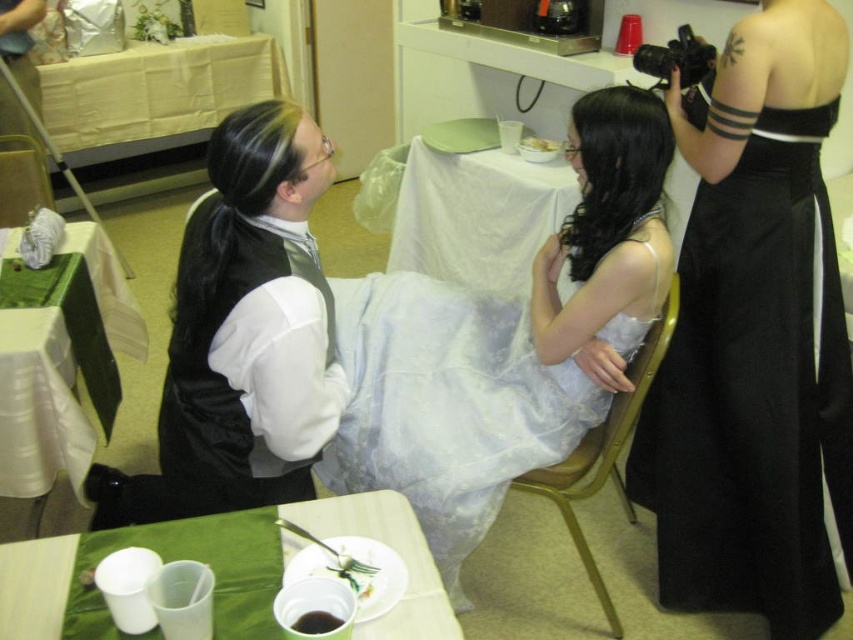
Does black satin dress at right lie in front of green fabric table at lower left?

Yes, it is in front of green fabric table at lower left.

Who is positioned more to the right, black satin dress at right or green fabric table at lower left?

From the viewer's perspective, black satin dress at right appears more on the right side.

Locate an element on the screen. The height and width of the screenshot is (640, 853). black satin dress at right is located at coordinates click(x=753, y=394).

Where is `black satin dress at right`? This screenshot has height=640, width=853. black satin dress at right is located at coordinates (753, 394).

Between point (109, 392) and point (564, 272), which one is positioned in front?

Point (109, 392)

Who is positioned more to the right, green fabric table at lower left or white cloth table at center?

From the viewer's perspective, white cloth table at center appears more on the right side.

Find the location of `green fabric table at lower left`. green fabric table at lower left is located at coordinates (62, 372).

Is velvet black vest at left positioned at the back of white plastic cups at lower left?

Yes, velvet black vest at left is behind white plastic cups at lower left.

Consider the image. Which of these two, velvet black vest at left or white plastic cups at lower left, stands taller?

velvet black vest at left is taller.

At what (x,y) coordinates should I click in order to perform the action: click on velvet black vest at left. Please return your answer as a coordinate pair (x, y). The image size is (853, 640). Looking at the image, I should click on point(241,333).